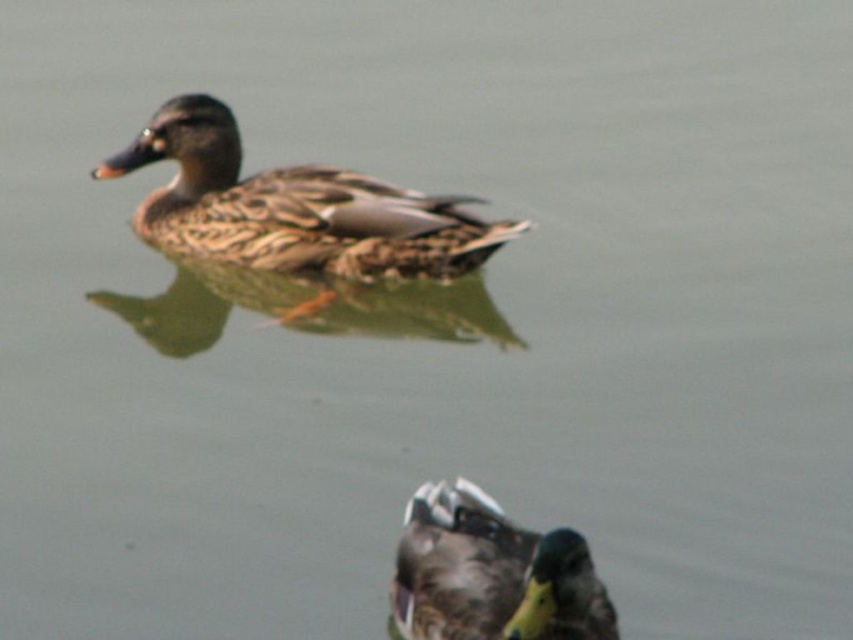
You are a birdwatcher trying to identify two ducks in the water. You notice the brown speckled feathers at upper center and the brown speckled duck at center. Which one is bigger?

The brown speckled feathers at upper center is larger in size than the brown speckled duck at center.

You are a birdwatcher trying to capture both the brown speckled feathers at upper center and the brown speckled duck at center in a single photo. Your camera has a maximum focus range of 2 meters. Can you fit both subjects within the focus range?

The brown speckled feathers at upper center and brown speckled duck at center are 1.82 meters apart, which is within the camera focus range of 2 meters. Yes, you can fit both subjects within the focus range.

You are a birdwatcher trying to identify ducks in the scene. You notice two brown speckled ducks. Which one is closer to you, the brown speckled feathers at upper center or the brown speckled duck at center?

The brown speckled feathers at upper center is closer to you because it is further to the viewer than the brown speckled duck at center.